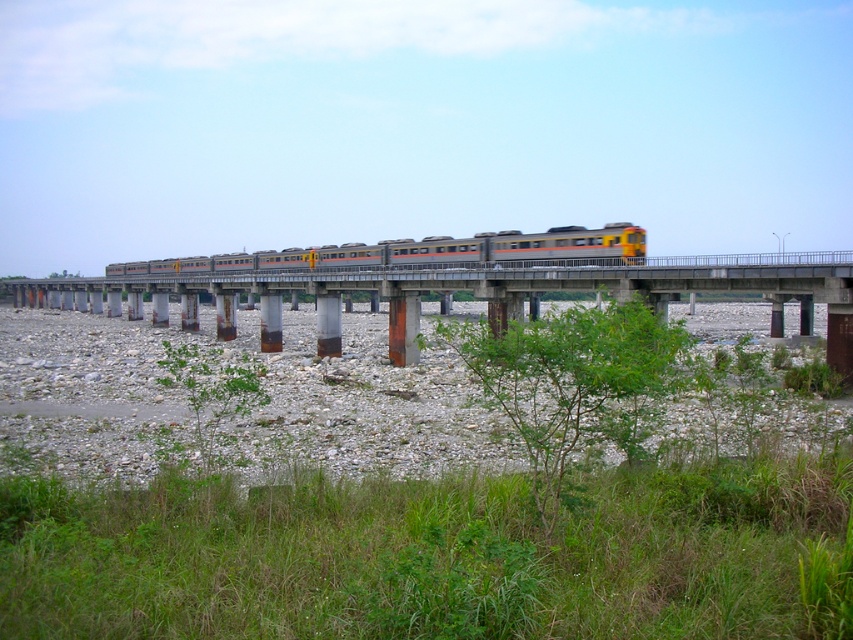
Is point (570, 259) more distant than point (621, 417)?

Yes, point (570, 259) is behind point (621, 417).

Between concrete bridge at center and green leafy shrub at lower center, which one appears on the right side from the viewer's perspective?

From the viewer's perspective, green leafy shrub at lower center appears more on the right side.

Does point (49, 288) come farther from viewer compared to point (561, 426)?

Yes, point (49, 288) is farther from viewer.

Locate an element on the screen. This screenshot has height=640, width=853. concrete bridge at center is located at coordinates (466, 289).

Between point (549, 481) and point (283, 257), which one is positioned behind?

The point (283, 257) is more distant.

The image size is (853, 640). Identify the location of green leafy shrub at lower center. (573, 381).

What do you see at coordinates (466, 289) in the screenshot? The image size is (853, 640). I see `concrete bridge at center` at bounding box center [466, 289].

Based on the photo, does concrete bridge at center have a lesser width compared to metallic silver train at center?

In fact, concrete bridge at center might be wider than metallic silver train at center.

Find the location of a particular element. The width and height of the screenshot is (853, 640). concrete bridge at center is located at coordinates (466, 289).